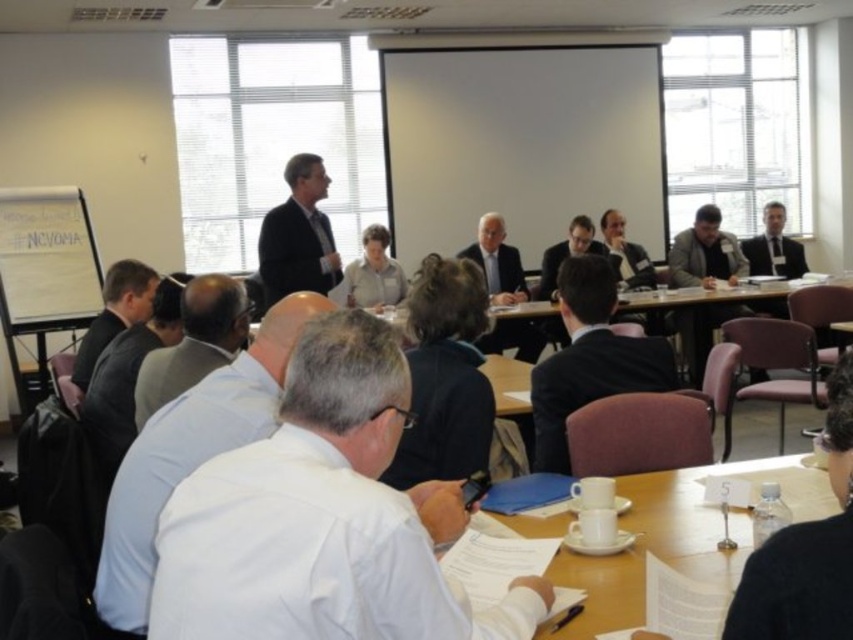
You are sitting at the back of the room and want to hand a document to the person wearing the white shirt at left and the dark gray suit at left. Which one is closer to the center of the table?

The white shirt at left is positioned on the right side of dark gray suit at left, so the dark gray suit at left is closer to the center of the table than the white shirt at left.

You are a participant in the meeting and need to retrieve your notes. You see the white paper at center and the black suit at center. Where should you look to find your notes?

The white paper at center is located below the black suit at center, so you should look below the black suit at center to find your notes.

You are sitting at the conference table and want to pass a document to the person at point (734, 237). There is an obstruction at point (213, 364). Can you reach them without moving around the table?

Point (213, 364) is in front of point (734, 237), so the obstruction at point (213, 364) would block the path. You need to move around the table to reach them.